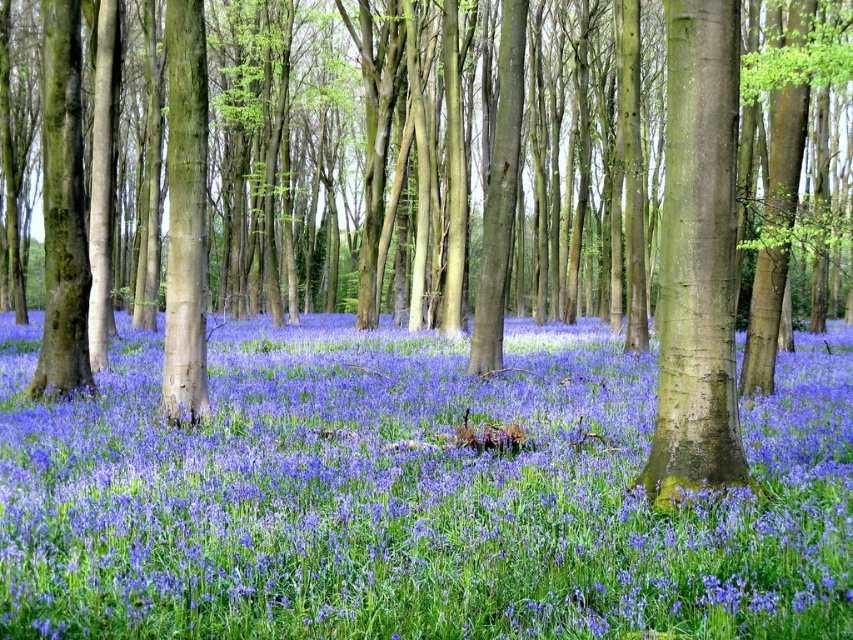
Question: Is purple matte flower at center wider than smooth brown tree trunk at center?

Choices:
 (A) yes
 (B) no

Answer: (A)

Question: Which object is closer to the camera taking this photo?

Choices:
 (A) smooth brown tree trunk at center
 (B) purple matte flower at center

Answer: (B)

Question: Which object is farther from the camera taking this photo?

Choices:
 (A) smooth brown tree trunk at center
 (B) purple matte flower at center

Answer: (A)

Question: Is purple matte flower at center smaller than smooth brown tree trunk at center?

Choices:
 (A) yes
 (B) no

Answer: (B)

Question: Is purple matte flower at center to the left of smooth brown tree trunk at center from the viewer's perspective?

Choices:
 (A) yes
 (B) no

Answer: (A)

Question: Which of the following is the farthest from the observer?

Choices:
 (A) smooth brown tree trunk at center
 (B) purple matte flower at center

Answer: (A)